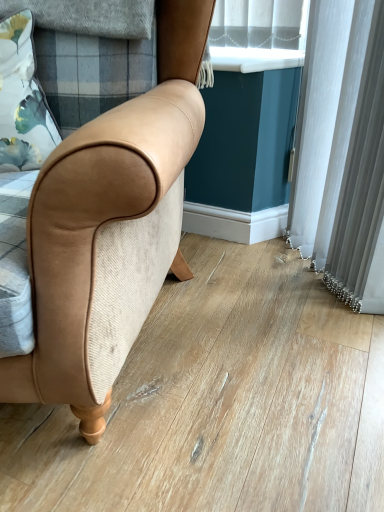
Question: From a real-world perspective, is tan leather chair at center physically below white plastic window sill at upper center?

Choices:
 (A) yes
 (B) no

Answer: (A)

Question: Is tan leather chair at center not close to white plastic window sill at upper center?

Choices:
 (A) no
 (B) yes

Answer: (A)

Question: From a real-world perspective, is tan leather chair at center on white plastic window sill at upper center?

Choices:
 (A) no
 (B) yes

Answer: (A)

Question: Considering the relative sizes of tan leather chair at center and white plastic window sill at upper center in the image provided, is tan leather chair at center bigger than white plastic window sill at upper center?

Choices:
 (A) no
 (B) yes

Answer: (B)

Question: Is tan leather chair at center smaller than white plastic window sill at upper center?

Choices:
 (A) no
 (B) yes

Answer: (A)

Question: Considering the relative sizes of tan leather chair at center and white plastic window sill at upper center in the image provided, is tan leather chair at center taller than white plastic window sill at upper center?

Choices:
 (A) no
 (B) yes

Answer: (B)

Question: Would you consider floral fabric pillow at upper left to be distant from white plastic window sill at upper center?

Choices:
 (A) no
 (B) yes

Answer: (A)

Question: Considering the relative sizes of floral fabric pillow at upper left and white plastic window sill at upper center in the image provided, is floral fabric pillow at upper left bigger than white plastic window sill at upper center?

Choices:
 (A) no
 (B) yes

Answer: (B)

Question: Considering the relative sizes of floral fabric pillow at upper left and white plastic window sill at upper center in the image provided, is floral fabric pillow at upper left shorter than white plastic window sill at upper center?

Choices:
 (A) no
 (B) yes

Answer: (A)

Question: From a real-world perspective, is floral fabric pillow at upper left on top of white plastic window sill at upper center?

Choices:
 (A) yes
 (B) no

Answer: (B)

Question: Is floral fabric pillow at upper left not within white plastic window sill at upper center?

Choices:
 (A) yes
 (B) no

Answer: (A)

Question: Does floral fabric pillow at upper left appear on the left side of white plastic window sill at upper center?

Choices:
 (A) yes
 (B) no

Answer: (A)

Question: Is floral fabric pillow at upper left behind tan leather chair at center?

Choices:
 (A) no
 (B) yes

Answer: (B)